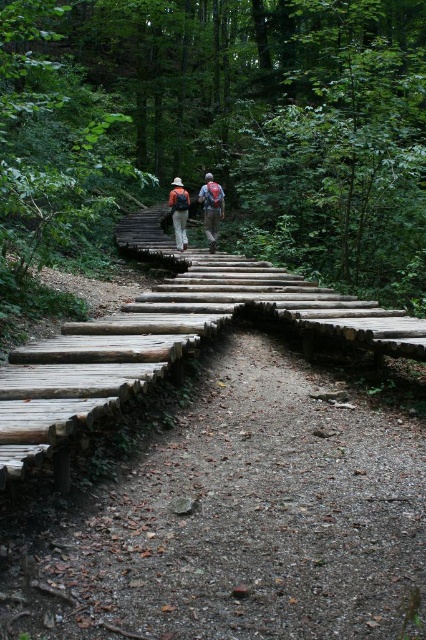
Question: Which point is farther to the camera?

Choices:
 (A) (63, 188)
 (B) (218, 198)
 (C) (167, 202)

Answer: (C)

Question: Can you confirm if natural wood stairs at center is smaller than natural wood bridge at center?

Choices:
 (A) no
 (B) yes

Answer: (A)

Question: Does natural wood stairs at center lie behind matte brown backpacks at center?

Choices:
 (A) no
 (B) yes

Answer: (A)

Question: Which of the following is the farthest from the observer?

Choices:
 (A) (183, 198)
 (B) (212, 193)

Answer: (A)

Question: Among these points, which one is nearest to the camera?

Choices:
 (A) (175, 241)
 (B) (218, 209)
 (C) (173, 225)
 (D) (310, 58)

Answer: (B)

Question: Considering the relative positions of natural wood stairs at center and matte gray backpack at center in the image provided, where is natural wood stairs at center located with respect to matte gray backpack at center?

Choices:
 (A) right
 (B) left

Answer: (B)